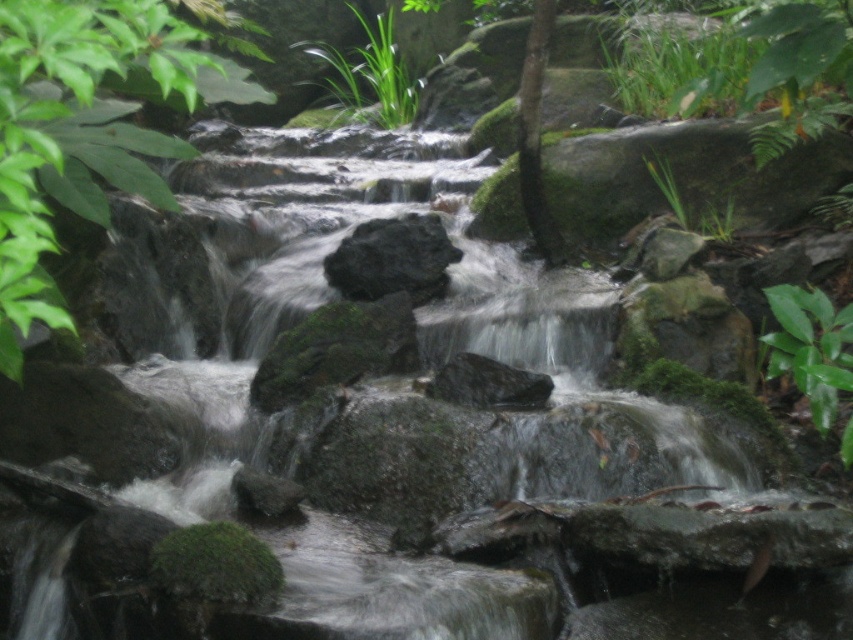
Question: Can you confirm if black matte rock at center is positioned above green mossy tree at center?

Choices:
 (A) yes
 (B) no

Answer: (B)

Question: Considering the relative positions of green matte leaf at upper right and green leafy plant at upper center in the image provided, where is green matte leaf at upper right located with respect to green leafy plant at upper center?

Choices:
 (A) above
 (B) below

Answer: (B)

Question: Does green leafy plant at upper center have a larger size compared to green mossy tree at center?

Choices:
 (A) no
 (B) yes

Answer: (B)

Question: Which object is closer to the camera taking this photo?

Choices:
 (A) green leafy plant at upper left
 (B) green leafy plant at upper center
 (C) green matte leaf at upper right

Answer: (A)

Question: Which object appears closest to the camera in this image?

Choices:
 (A) green leafy plant at upper left
 (B) green mossy tree at center

Answer: (A)

Question: Among these points, which one is nearest to the camera?

Choices:
 (A) (345, 108)
 (B) (428, 248)
 (C) (801, 364)
 (D) (547, 26)

Answer: (C)